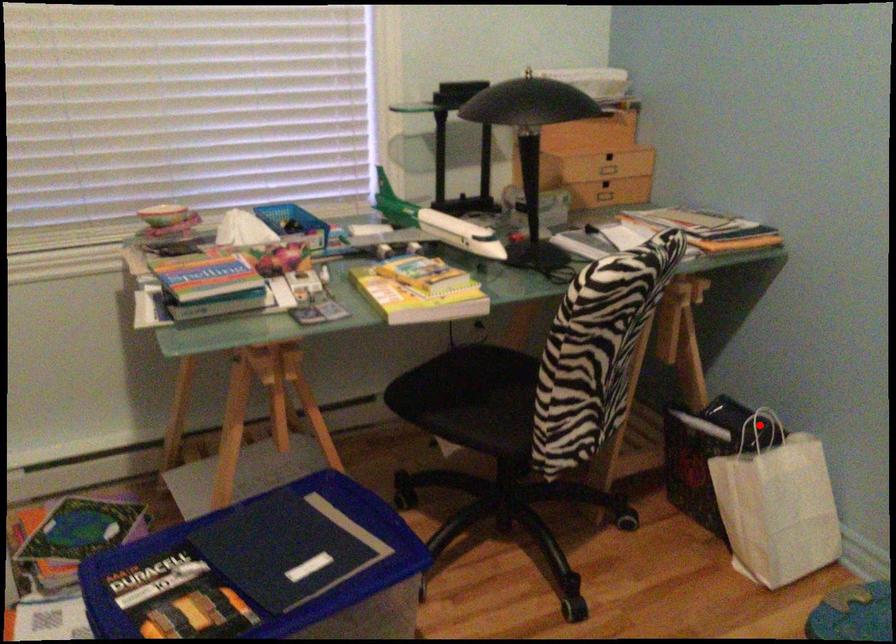
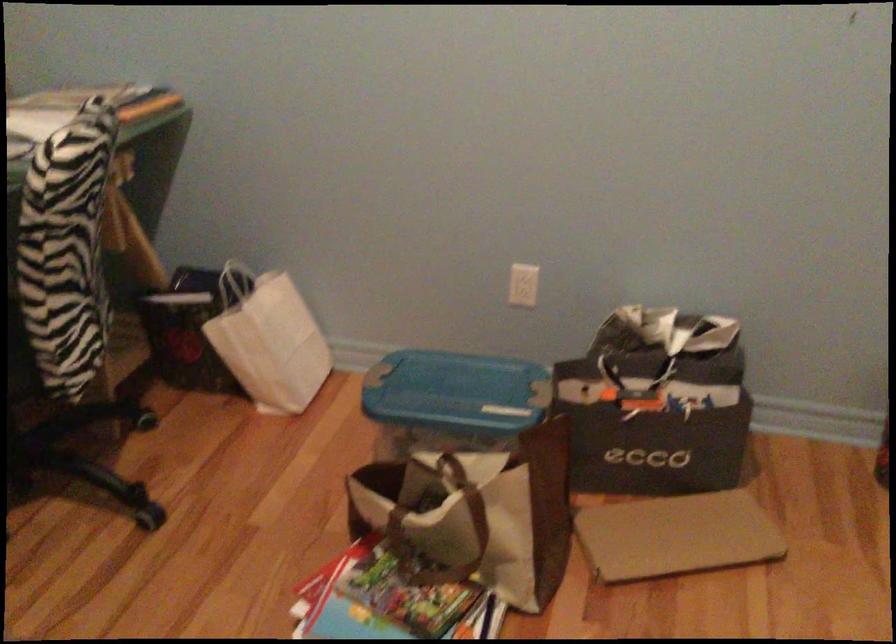
Find the pixel in the second image that matches the highlighted location in the first image.

(236, 281)